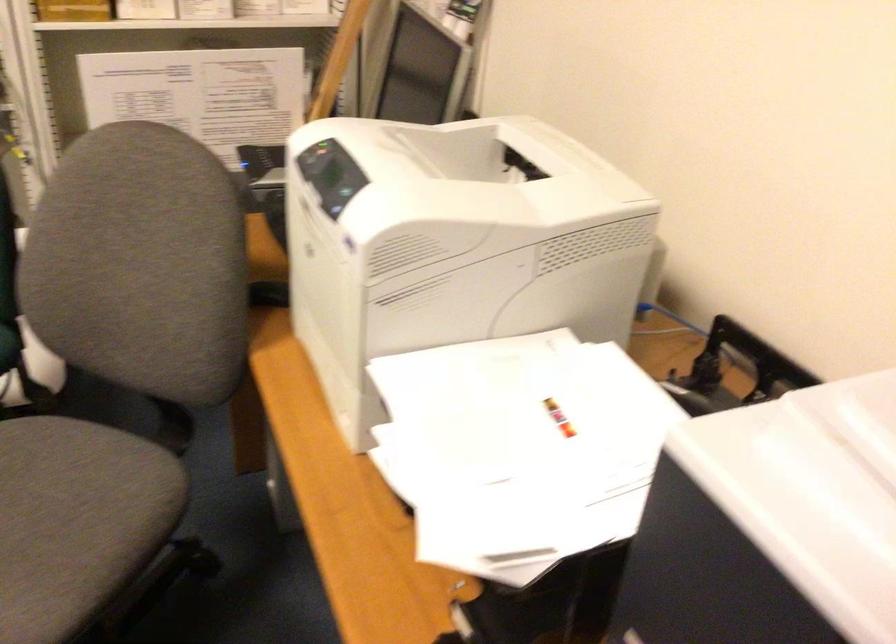
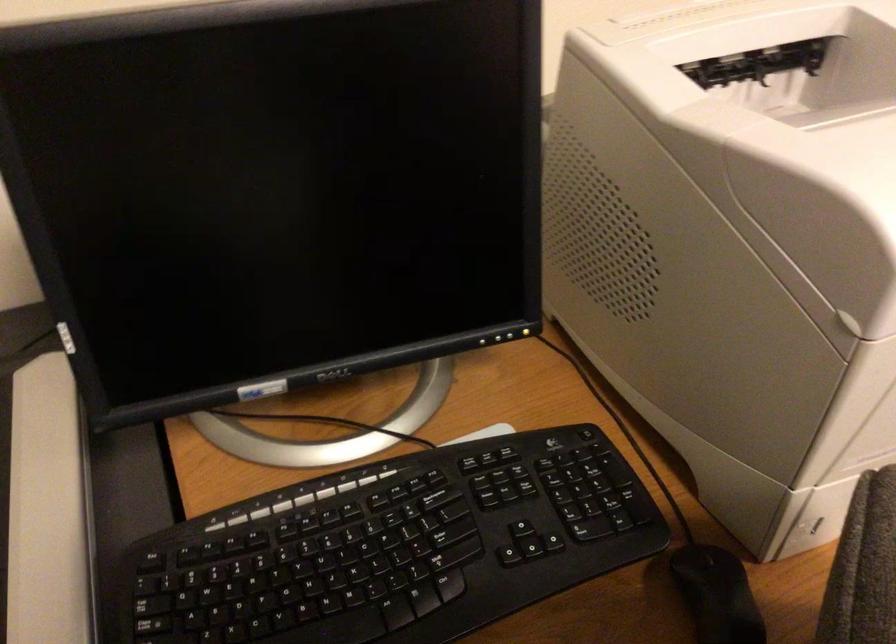
In the second image, find the point that corresponds to (270,288) in the first image.

(717, 594)